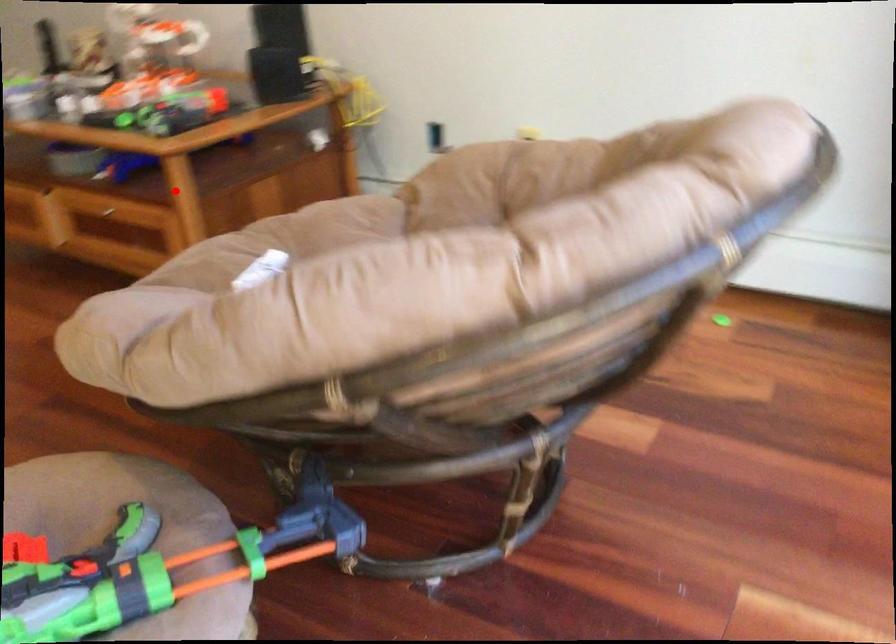
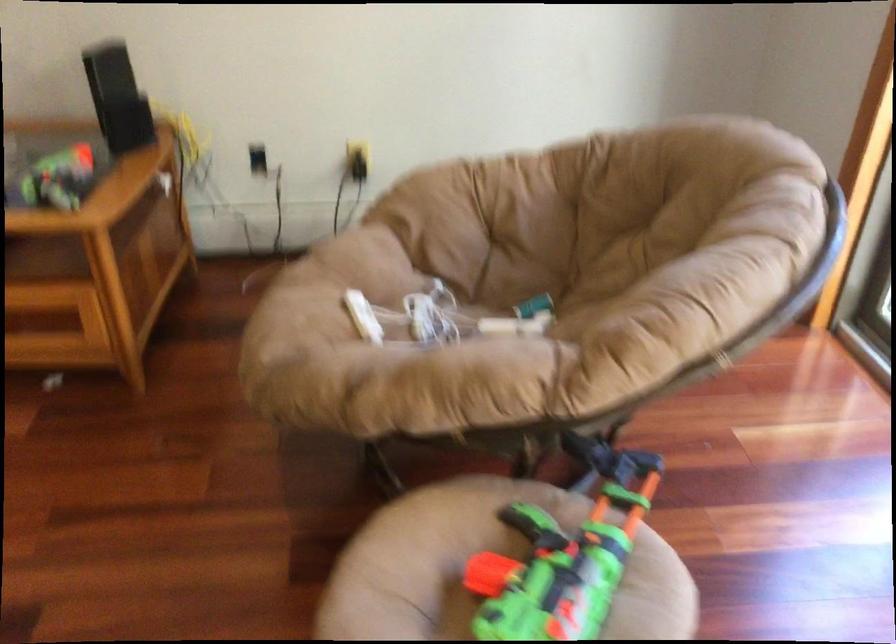
Find the pixel in the second image that matches the highlighted location in the first image.

(95, 263)